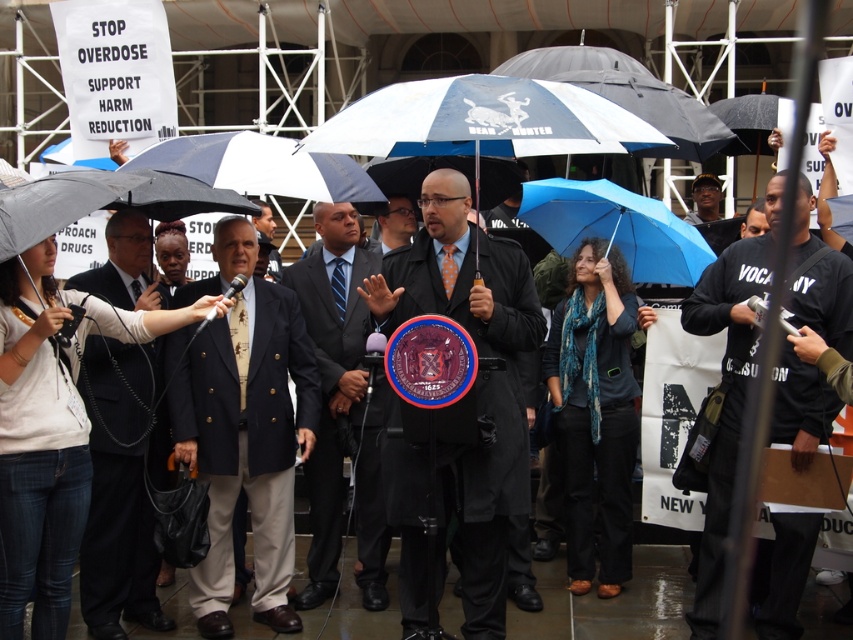
You are organizing a photo shoot for a magazine article about the protest. You want to ensure that both the dark suit at left and the dark blue suit at center are clearly visible in the photo. Given their sizes, which suit should you position closer to the camera to make them appear equally sized in the final image?

Since the dark suit at left occupies less space than the dark blue suit at center, you should position the dark suit at left closer to the camera to make them appear equally sized in the photo.

You are a photographer standing at the camera position. You want to capture a closeup shot of the matte black coat at center. Given that your camera has a maximum zoom range of 15 meters, can you achieve this without moving closer?

The matte black coat at center is 17.67 meters away from the camera, which exceeds the camera maximum zoom range of 15 meters. Therefore, you cannot capture a closeup shot without moving closer.

Consider the image. You are organizing a photo shoot and need to ensure that two models wearing the matte black coat at center and dark suit at center can stand side by side without overlapping. Given their sizes, is there enough space between them if they each occupy their own personal space bubble of 0.5 meters?

The matte black coat at center is wider than the dark suit at center. Since each requires 0.5 meters of personal space, the total space needed would be at least 1 meter. However, the exact width difference isn not provided, so it depends on how much wider the coat is. If the combined width plus spacing fits within the available space, they can stand side by side.